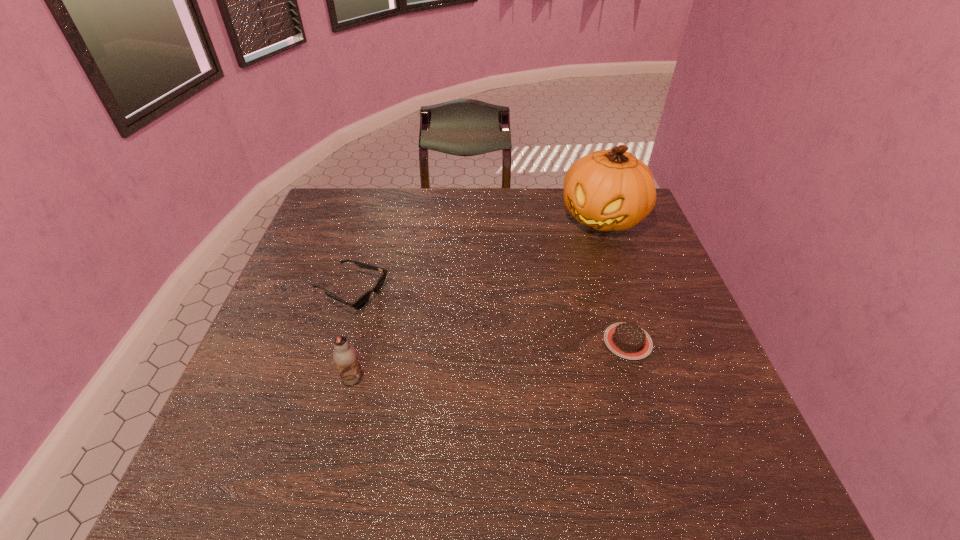
This screenshot has height=540, width=960. I want to click on free space between the pumpkin and the second tallest object, so click(477, 298).

Locate an element on the screen. free area in between the pumpkin and the sunglasses is located at coordinates (477, 254).

Where is `free space between the nearest object and the third tallest object`? free space between the nearest object and the third tallest object is located at coordinates (352, 335).

At what (x,y) coordinates should I click in order to perform the action: click on vacant space in between the second nearest object and the farthest object. Please return your answer as a coordinate pair (x, y). The height and width of the screenshot is (540, 960). Looking at the image, I should click on (615, 279).

The height and width of the screenshot is (540, 960). Find the location of `vacant space that's between the chocolate milk and the third tallest object`. vacant space that's between the chocolate milk and the third tallest object is located at coordinates (352, 335).

The image size is (960, 540). I want to click on free spot between the second nearest object and the chocolate milk, so click(491, 360).

Find the location of a particular element. Image resolution: width=960 pixels, height=540 pixels. the third closest object to the chocolate cake is located at coordinates (345, 357).

Find the location of a particular element. This screenshot has height=540, width=960. the closest object relative to the second farthest object is located at coordinates (345, 357).

Identify the location of vacant space that satisfies the following two spatial constraints: 1. on the front side of the third nearest object; 2. on the left side of the second nearest object. (336, 341).

Where is `vacant space that satisfies the following two spatial constraints: 1. on the front side of the chocolate milk; 2. on the right side of the third nearest object`? vacant space that satisfies the following two spatial constraints: 1. on the front side of the chocolate milk; 2. on the right side of the third nearest object is located at coordinates (325, 378).